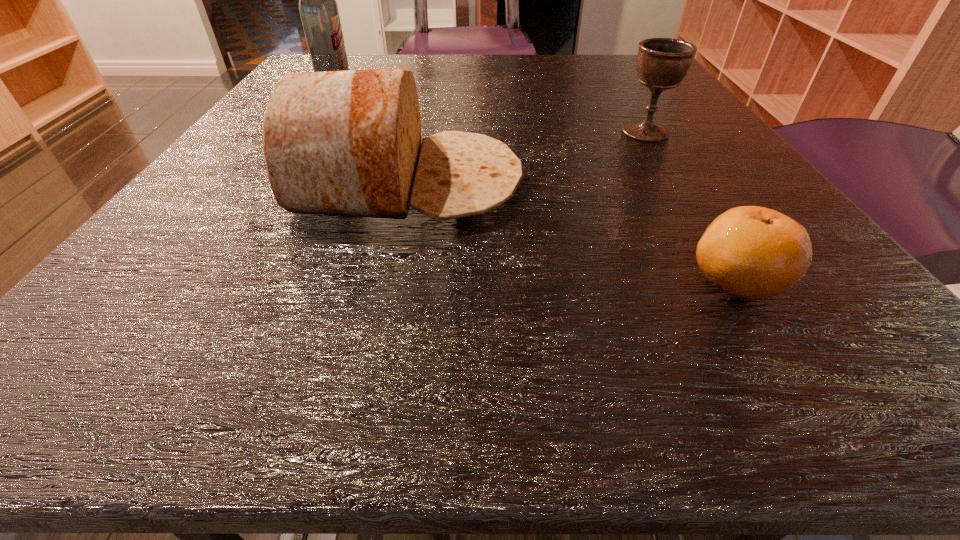
At what (x,y) coordinates should I click in order to perform the action: click on free space that satisfies the following two spatial constraints: 1. on the front-facing side of the tallest object; 2. on the back side of the third nearest object. Please return your answer as a coordinate pair (x, y). This screenshot has width=960, height=540. Looking at the image, I should click on (297, 132).

You are a GUI agent. You are given a task and a screenshot of the screen. Output one action in this format:
    pyautogui.click(x=<x>, y=<y>)
    Task: Click on the free location that satisfies the following two spatial constraints: 1. at the sliced end of the second object from left to right; 2. on the right side of the clementine
    This screenshot has height=540, width=960.
    Given the screenshot: What is the action you would take?
    pyautogui.click(x=385, y=279)

Where is `vacant space that satisfies the following two spatial constraints: 1. on the front-facing side of the nearest object; 2. on the left side of the tallest object`? This screenshot has height=540, width=960. vacant space that satisfies the following two spatial constraints: 1. on the front-facing side of the nearest object; 2. on the left side of the tallest object is located at coordinates (195, 279).